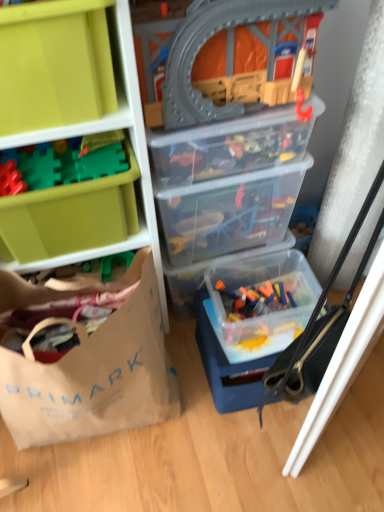
Find the location of a particular element. Image resolution: width=384 pixels, height=512 pixels. translucent plastic container at lower right, the third toy positioned from the top is located at coordinates (260, 298).

How much space does translucent plastic container at lower right, which is the first toy in back-to-front order, occupy vertically?

It is 7.48 centimeters.

How much space does transparent plastic toy train set at center, the 3th storage box in the front-to-back sequence, occupy vertically?

transparent plastic toy train set at center, the 3th storage box in the front-to-back sequence, is 5.56 inches tall.

Find the location of `transparent plastic toy train set at center, the 3th storage box in the front-to-back sequence`. transparent plastic toy train set at center, the 3th storage box in the front-to-back sequence is located at coordinates (232, 145).

This screenshot has width=384, height=512. Describe the element at coordinates (70, 216) in the screenshot. I see `green plastic storage box at left, the fifth storage box when ordered from back to front` at that location.

The width and height of the screenshot is (384, 512). I want to click on transparent plastic storage box at center, which is counted as the 4th storage box, starting from the front, so click(x=229, y=213).

You are a GUI agent. You are given a task and a screenshot of the screen. Output one action in this format:
    pyautogui.click(x=<x>, y=<y>)
    Task: Click on the green plastic blocks at upper left, the second toy positioned from the front
    Image resolution: width=384 pixels, height=512 pixels.
    Given the screenshot: What is the action you would take?
    pyautogui.click(x=99, y=163)

Locate an element on the screen. Image resolution: width=384 pixels, height=512 pixels. translucent plastic container at center, acting as the sixth storage box starting from the front is located at coordinates (204, 272).

In terms of width, does brown paper bag at lower left look wider or thinner when compared to transparent plastic toy train set at center, the 4th storage box when ordered from back to front?

brown paper bag at lower left is wider than transparent plastic toy train set at center, the 4th storage box when ordered from back to front.

Locate an element on the screen. Image resolution: width=384 pixels, height=512 pixels. storage box that is the 2nd one when counting backward from the brown paper bag at lower left is located at coordinates 232,145.

From the image's perspective, who appears lower, brown paper bag at lower left or transparent plastic toy train set at center, the 4th storage box when ordered from back to front?

brown paper bag at lower left is shown below in the image.

Which point is more distant from viewer, (7, 404) or (191, 174)?

The point (191, 174) is farther.

How different are the orientations of green plastic blocks at upper left, which is counted as the first toy, starting from the left, and transparent plastic toy train set at center, the 4th storage box when ordered from back to front, in degrees?

The angle between the facing direction of green plastic blocks at upper left, which is counted as the first toy, starting from the left, and the facing direction of transparent plastic toy train set at center, the 4th storage box when ordered from back to front, is 0.904 degrees.

Is green plastic blocks at upper left, which is counted as the first toy, starting from the left, far from transparent plastic toy train set at center, the 3th storage box in the front-to-back sequence?

That's not correct — green plastic blocks at upper left, which is counted as the first toy, starting from the left, is a little close to transparent plastic toy train set at center, the 3th storage box in the front-to-back sequence.

Is green plastic blocks at upper left, the second toy positioned from the front, looking in the opposite direction of transparent plastic toy train set at center, the 4th storage box when ordered from back to front?

green plastic blocks at upper left, the second toy positioned from the front, does not have its back to transparent plastic toy train set at center, the 4th storage box when ordered from back to front.

Considering the positions of objects green plastic blocks at upper left, the 2th toy positioned from the back, and transparent plastic toy train set at center, the 4th storage box when ordered from back to front, in the image provided, who is more to the right, green plastic blocks at upper left, the 2th toy positioned from the back, or transparent plastic toy train set at center, the 4th storage box when ordered from back to front,?

transparent plastic toy train set at center, the 4th storage box when ordered from back to front, is more to the right.

Based on their sizes in the image, would you say green plastic blocks at upper left, the second toy positioned from the front, is bigger or smaller than green plastic storage box at left, acting as the 2th storage box starting from the front?

Considering their sizes, green plastic blocks at upper left, the second toy positioned from the front, takes up less space than green plastic storage box at left, acting as the 2th storage box starting from the front.

Is green plastic blocks at upper left, the 2th toy positioned from the back, at the right side of green plastic storage box at left, acting as the 2th storage box starting from the front?

Yes, green plastic blocks at upper left, the 2th toy positioned from the back, is to the right of green plastic storage box at left, acting as the 2th storage box starting from the front.

Is green plastic blocks at upper left, the second toy positioned from the front, taller than green plastic storage box at left, acting as the 2th storage box starting from the front?

In fact, green plastic blocks at upper left, the second toy positioned from the front, may be shorter than green plastic storage box at left, acting as the 2th storage box starting from the front.

From a real-world perspective, between green plastic blocks at upper left, the 3th toy positioned from the right, and green plastic storage box at left, the fifth storage box when ordered from back to front, who is vertically lower?

From a 3D spatial view, green plastic storage box at left, the fifth storage box when ordered from back to front, is below.

Is translucent plastic container at center, acting as the sixth storage box starting from the front, positioned behind translucent plastic container at lower right, positioned as the 5th storage box in front-to-back order?

Yes, translucent plastic container at center, acting as the sixth storage box starting from the front, is further from the camera.

From a real-world perspective, who is located lower, translucent plastic container at center, acting as the sixth storage box starting from the front, or translucent plastic container at lower right, positioned as the 5th storage box in front-to-back order?

translucent plastic container at center, acting as the sixth storage box starting from the front, from a real-world perspective.

Where is `storage box located below the translucent plastic container at center, which is the 1th storage box in back-to-front order (from the image's perspective)`? storage box located below the translucent plastic container at center, which is the 1th storage box in back-to-front order (from the image's perspective) is located at coordinates (260, 303).

Would you say translucent plastic container at center, acting as the sixth storage box starting from the front, contains translucent plastic container at lower right, the 2th storage box in the back-to-front sequence?

Actually, translucent plastic container at lower right, the 2th storage box in the back-to-front sequence, is outside translucent plastic container at center, acting as the sixth storage box starting from the front.

How far apart are brown paper bag at lower left and transparent plastic storage box at center, which is counted as the 4th storage box, starting from the front?

brown paper bag at lower left and transparent plastic storage box at center, which is counted as the 4th storage box, starting from the front, are 12.84 inches apart from each other.

Locate an element on the screen. storage box that is the 1st object above the brown paper bag at lower left (from a real-world perspective) is located at coordinates (229, 213).

Is brown paper bag at lower left oriented towards transparent plastic storage box at center, which is counted as the 4th storage box, starting from the front?

No.

From the image's perspective, does brown paper bag at lower left appear lower than transparent plastic storage box at center, which is counted as the 4th storage box, starting from the front?

Indeed, from the image's perspective, brown paper bag at lower left is shown beneath transparent plastic storage box at center, which is counted as the 4th storage box, starting from the front.

Is point (291, 287) closer or farther from the camera than point (264, 215)?

Point (291, 287) appears to be farther away from the viewer than point (264, 215).

From the image's perspective, is translucent plastic container at lower right, which is the first toy from bottom to top, located beneath transparent plastic storage box at center, which is counted as the third storage box, starting from the back?

Yes, from the image's perspective, translucent plastic container at lower right, which is the first toy from bottom to top, is below transparent plastic storage box at center, which is counted as the third storage box, starting from the back.

Considering the relative sizes of translucent plastic container at lower right, which is the first toy in back-to-front order, and transparent plastic storage box at center, which is counted as the 4th storage box, starting from the front, in the image provided, is translucent plastic container at lower right, which is the first toy in back-to-front order, shorter than transparent plastic storage box at center, which is counted as the 4th storage box, starting from the front,?

Yes.

In terms of width, does translucent plastic container at lower right, which is the first toy from bottom to top, look wider or thinner when compared to transparent plastic storage box at center, which is counted as the third storage box, starting from the back?

translucent plastic container at lower right, which is the first toy from bottom to top, is thinner than transparent plastic storage box at center, which is counted as the third storage box, starting from the back.

I want to click on the 1st toy behind the matte green plastic storage box at upper left, placed as the first storage box when sorted from front to back, counting from the anchor's position, so click(226, 50).

Would you say transparent plastic train set at upper center, the second toy when ordered from right to left, is to the left or to the right of matte green plastic storage box at upper left, the sixth storage box positioned from the back, in the picture?

From the image, it's evident that transparent plastic train set at upper center, the second toy when ordered from right to left, is to the right of matte green plastic storage box at upper left, the sixth storage box positioned from the back.

Who is bigger, transparent plastic train set at upper center, the second toy when ordered from right to left, or matte green plastic storage box at upper left, placed as the first storage box when sorted from front to back?

transparent plastic train set at upper center, the second toy when ordered from right to left, is bigger.

Considering the sizes of objects transparent plastic train set at upper center, the 3th toy from the bottom, and matte green plastic storage box at upper left, the sixth storage box positioned from the back, in the image provided, who is shorter, transparent plastic train set at upper center, the 3th toy from the bottom, or matte green plastic storage box at upper left, the sixth storage box positioned from the back,?

matte green plastic storage box at upper left, the sixth storage box positioned from the back.

In order to click on the 3rd storage box above the brown paper bag at lower left (from a real-world perspective) in this screenshot , I will do `click(232, 145)`.

You are a GUI agent. You are given a task and a screenshot of the screen. Output one action in this format:
    pyautogui.click(x=<x>, y=<y>)
    Task: Click on the 1st toy below when counting from the transparent plastic toy train set at center, the 3th storage box in the front-to-back sequence (from the image's perspective)
    This screenshot has height=512, width=384.
    Given the screenshot: What is the action you would take?
    pyautogui.click(x=99, y=163)

From the image, which object appears to be farther from matte green plastic storage box at upper left, placed as the first storage box when sorted from front to back, translucent plastic container at center, which is the 1th storage box in back-to-front order, or transparent plastic storage box at center, which is counted as the 4th storage box, starting from the front?

translucent plastic container at center, which is the 1th storage box in back-to-front order.

Based on their spatial positions, is translucent plastic container at lower right, which is the first toy in back-to-front order, or transparent plastic train set at upper center, positioned as the 2th toy in left-to-right order, closer to matte green plastic storage box at upper left, the sixth storage box positioned from the back?

transparent plastic train set at upper center, positioned as the 2th toy in left-to-right order, is positioned closer to the anchor matte green plastic storage box at upper left, the sixth storage box positioned from the back.

Which object lies nearer to the anchor point translucent plastic container at lower right, positioned as the 5th storage box in front-to-back order, translucent plastic container at center, acting as the sixth storage box starting from the front, or translucent plastic container at lower right, the third toy positioned from the left?

The object closer to translucent plastic container at lower right, positioned as the 5th storage box in front-to-back order, is translucent plastic container at lower right, the third toy positioned from the left.

Looking at the image, which one is located closer to matte green plastic storage box at upper left, the sixth storage box positioned from the back, green plastic storage box at left, acting as the 2th storage box starting from the front, or translucent plastic container at lower right, positioned as the 5th storage box in front-to-back order?

green plastic storage box at left, acting as the 2th storage box starting from the front.

When comparing their distances from translucent plastic container at lower right, which is the first toy from bottom to top, does brown paper bag at lower left or green plastic storage box at left, the fifth storage box when ordered from back to front, seem closer?

brown paper bag at lower left lies closer to translucent plastic container at lower right, which is the first toy from bottom to top, than the other object.

Which object lies further to the anchor point translucent plastic container at center, acting as the sixth storage box starting from the front, transparent plastic toy train set at center, the 3th storage box in the front-to-back sequence, or green plastic blocks at upper left, the 2th toy positioned from the bottom?

green plastic blocks at upper left, the 2th toy positioned from the bottom.

Estimate the real-world distances between objects in this image. Which object is closer to transparent plastic train set at upper center, positioned as the 2th toy in left-to-right order, brown paper bag at lower left or green plastic blocks at upper left, which appears as the second toy when viewed from the top?

Among the two, green plastic blocks at upper left, which appears as the second toy when viewed from the top, is located nearer to transparent plastic train set at upper center, positioned as the 2th toy in left-to-right order.

From the image, which object appears to be farther from green plastic storage box at left, acting as the 2th storage box starting from the front, brown paper bag at lower left or matte green plastic storage box at upper left, placed as the first storage box when sorted from front to back?

Based on the image, brown paper bag at lower left appears to be further to green plastic storage box at left, acting as the 2th storage box starting from the front.

Locate an element on the screen. The image size is (384, 512). toy between transparent plastic toy train set at center, the 3th storage box in the front-to-back sequence, and translucent plastic container at center, acting as the sixth storage box starting from the front, from top to bottom is located at coordinates (99, 163).

This screenshot has width=384, height=512. Find the location of `storage box located between matte green plastic storage box at upper left, the sixth storage box positioned from the back, and transparent plastic storage box at center, which is counted as the 4th storage box, starting from the front, in the left-right direction`. storage box located between matte green plastic storage box at upper left, the sixth storage box positioned from the back, and transparent plastic storage box at center, which is counted as the 4th storage box, starting from the front, in the left-right direction is located at coordinates (232, 145).

At what (x,y) coordinates should I click in order to perform the action: click on toy between transparent plastic toy train set at center, the 3th storage box in the front-to-back sequence, and translucent plastic container at lower right, the third toy positioned from the top, in the vertical direction. Please return your answer as a coordinate pair (x, y). The width and height of the screenshot is (384, 512). Looking at the image, I should click on (99, 163).

Identify the location of toy between green plastic blocks at upper left, which is counted as the first toy, starting from the left, and transparent plastic storage box at center, which is counted as the third storage box, starting from the back, in the horizontal direction. This screenshot has width=384, height=512. (226, 50).